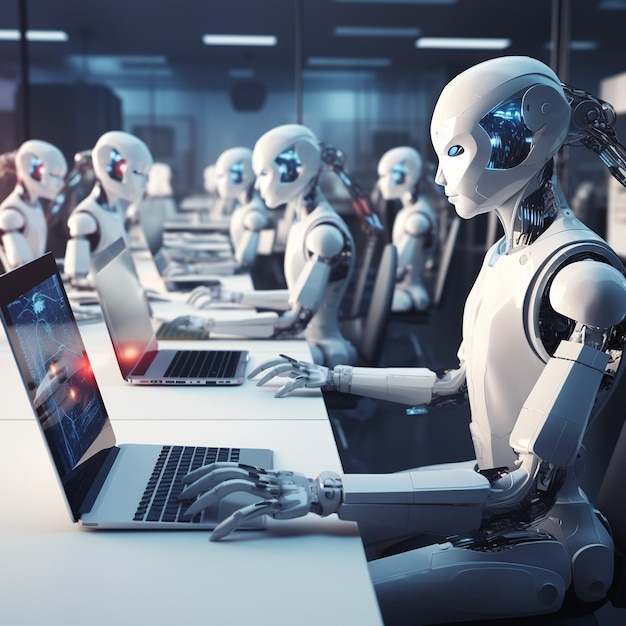
Image resolution: width=626 pixels, height=626 pixels. I want to click on seat, so (x=618, y=399), (x=618, y=463), (x=381, y=268), (x=377, y=317), (x=454, y=240), (x=442, y=270), (x=409, y=327), (x=603, y=613), (x=339, y=407).